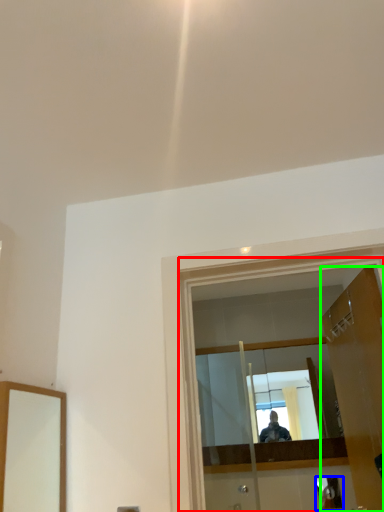
Question: Which object is positioned closest to glass door (highlighted by a red box)? Select from reflection (highlighted by a blue box) and door (highlighted by a green box).

Choices:
 (A) reflection
 (B) door

Answer: (B)